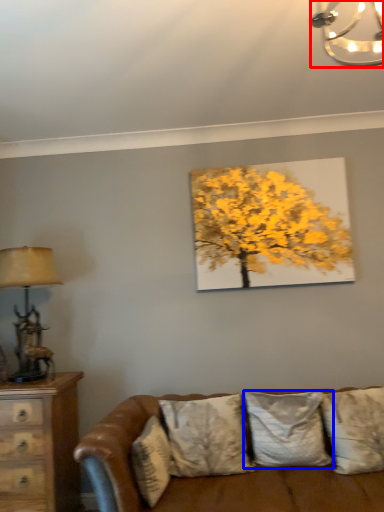
Question: Which object appears closest to the camera in this image, lamp (highlighted by a red box) or pillow (highlighted by a blue box)?

Choices:
 (A) lamp
 (B) pillow

Answer: (A)